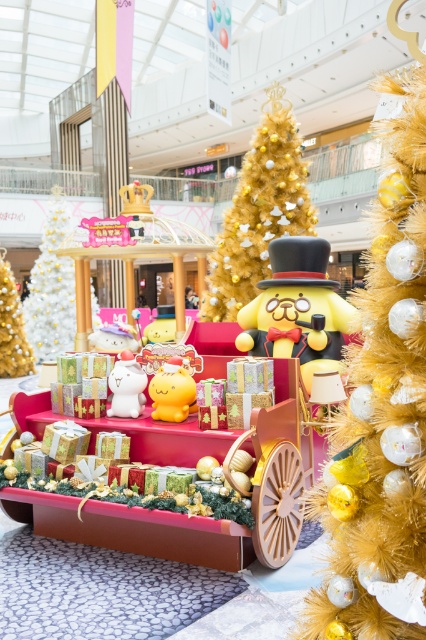
Can you confirm if gold tinsel christmas tree at center is positioned to the left of white plush cat at center?

Incorrect, gold tinsel christmas tree at center is not on the left side of white plush cat at center.

Does gold tinsel christmas tree at center have a lesser height compared to white plush cat at center?

Incorrect, gold tinsel christmas tree at center's height does not fall short of white plush cat at center's.

Does point (215, 320) come closer to viewer compared to point (135, 392)?

No, it is not.

Where is `gold tinsel christmas tree at center`? This screenshot has height=640, width=426. gold tinsel christmas tree at center is located at coordinates (259, 211).

Does gold textured christmas tree at center appear on the left side of white plush cat at center?

Incorrect, gold textured christmas tree at center is not on the left side of white plush cat at center.

This screenshot has height=640, width=426. What do you see at coordinates (382, 406) in the screenshot?
I see `gold textured christmas tree at center` at bounding box center [382, 406].

Image resolution: width=426 pixels, height=640 pixels. Describe the element at coordinates (382, 406) in the screenshot. I see `gold textured christmas tree at center` at that location.

I want to click on gold textured christmas tree at center, so click(x=382, y=406).

Is shiny gold cart at center above gold glittering christmas tree at left?

No, shiny gold cart at center is not above gold glittering christmas tree at left.

Where is `shiny gold cart at center`? shiny gold cart at center is located at coordinates (189, 461).

Locate an element on the screen. This screenshot has height=640, width=426. shiny gold cart at center is located at coordinates (189, 461).

You are a GUI agent. You are given a task and a screenshot of the screen. Output one action in this format:
    pyautogui.click(x=<x>, y=<y>)
    Task: Click on the shiny gold cart at center
    The width and height of the screenshot is (426, 640).
    Given the screenshot: What is the action you would take?
    pyautogui.click(x=189, y=461)